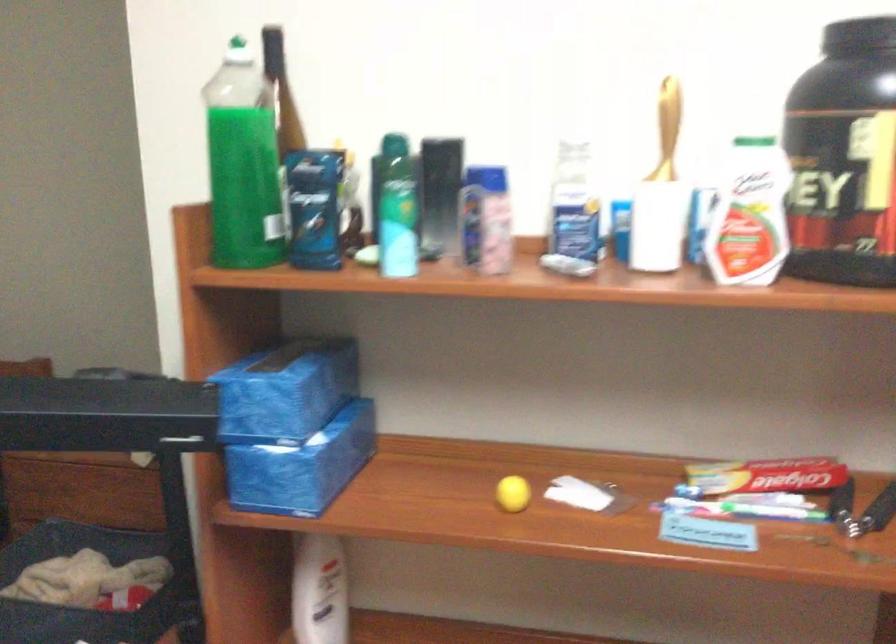
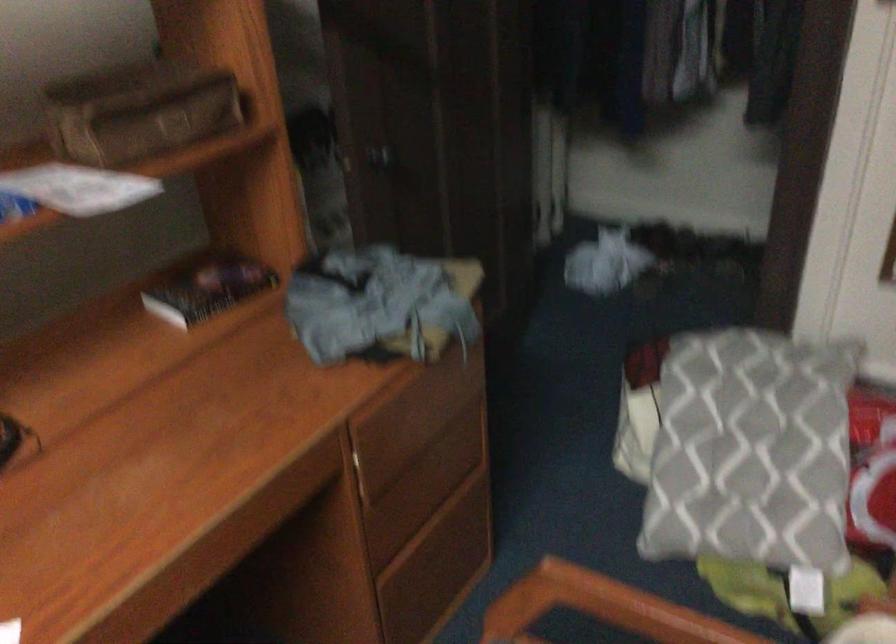
The first image is from the beginning of the video and the second image is from the end. How did the camera likely rotate when shooting the video?

The rotation direction of the camera is left-down.